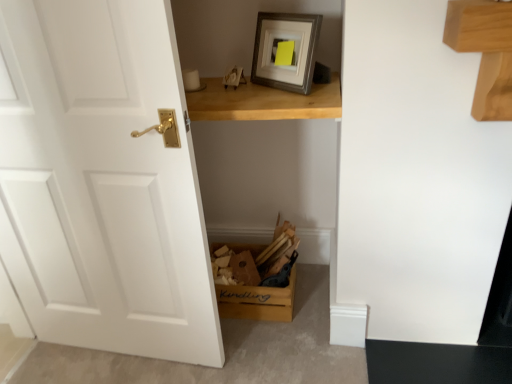
Question: Should I look upward or downward to see white matte door at left?

Choices:
 (A) up
 (B) down

Answer: (B)

Question: Can you confirm if light brown wooden table at upper center is taller than white matte door at left?

Choices:
 (A) yes
 (B) no

Answer: (B)

Question: Does light brown wooden table at upper center have a lesser width compared to white matte door at left?

Choices:
 (A) no
 (B) yes

Answer: (A)

Question: From the image's perspective, does light brown wooden table at upper center appear lower than white matte door at left?

Choices:
 (A) yes
 (B) no

Answer: (B)

Question: Does light brown wooden table at upper center have a lesser height compared to white matte door at left?

Choices:
 (A) no
 (B) yes

Answer: (B)

Question: Is light brown wooden table at upper center to the right of white matte door at left from the viewer's perspective?

Choices:
 (A) no
 (B) yes

Answer: (B)

Question: Considering the relative positions of light brown wooden table at upper center and white matte door at left in the image provided, is light brown wooden table at upper center in front of white matte door at left?

Choices:
 (A) yes
 (B) no

Answer: (B)

Question: Is wooden kindling box at lower center aimed at light brown wooden table at upper center?

Choices:
 (A) no
 (B) yes

Answer: (A)

Question: Does wooden kindling box at lower center have a greater height compared to light brown wooden table at upper center?

Choices:
 (A) yes
 (B) no

Answer: (A)

Question: Is the depth of wooden kindling box at lower center greater than that of light brown wooden table at upper center?

Choices:
 (A) no
 (B) yes

Answer: (B)

Question: Is wooden kindling box at lower center closer to the viewer compared to light brown wooden table at upper center?

Choices:
 (A) no
 (B) yes

Answer: (A)

Question: Does wooden kindling box at lower center appear on the left side of light brown wooden table at upper center?

Choices:
 (A) yes
 (B) no

Answer: (A)

Question: From the image's perspective, is wooden kindling box at lower center below light brown wooden table at upper center?

Choices:
 (A) no
 (B) yes

Answer: (B)

Question: Is wooden kindling box at lower center at the right side of white matte door at left?

Choices:
 (A) yes
 (B) no

Answer: (A)